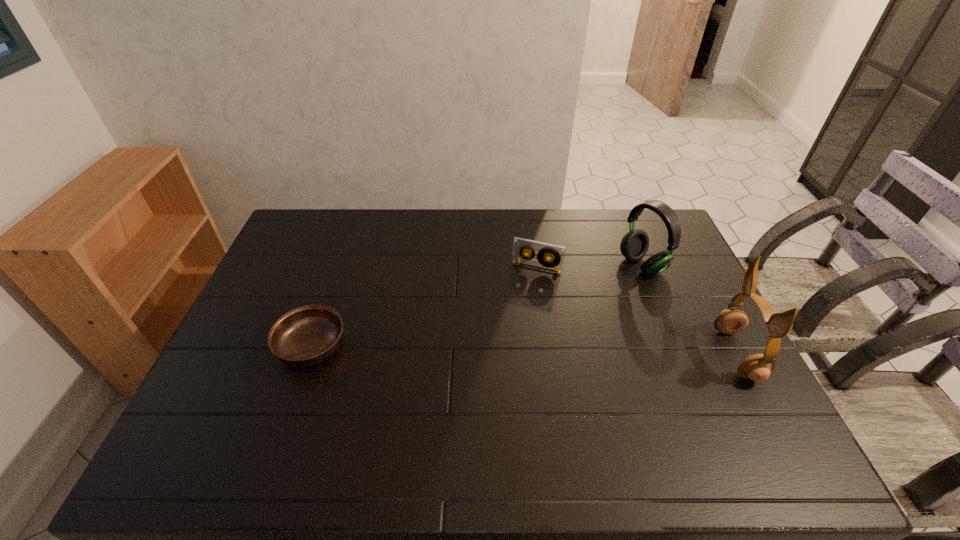
Locate an element on the screen. The width and height of the screenshot is (960, 540). free space located on the front-facing side of the earphone is located at coordinates (603, 354).

At what (x,y) coordinates should I click in order to perform the action: click on free point located 0.340m at the front of the videotape with visible reels. Please return your answer as a coordinate pair (x, y). This screenshot has height=540, width=960. Looking at the image, I should click on (500, 355).

At what (x,y) coordinates should I click in order to perform the action: click on vacant space situated 0.170m at the front of the videotape with visible reels. Please return your answer as a coordinate pair (x, y). The height and width of the screenshot is (540, 960). Looking at the image, I should click on (516, 311).

Locate an element on the screen. blank space located 0.060m at the front of the videotape with visible reels is located at coordinates (525, 287).

The width and height of the screenshot is (960, 540). I want to click on vacant space located 0.210m on the ear cups of the headset, so [x=576, y=298].

Find the location of a particular element. free space located 0.290m on the ear cups of the headset is located at coordinates (556, 307).

The image size is (960, 540). I want to click on vacant space located 0.360m on the ear cups of the headset, so click(537, 316).

This screenshot has width=960, height=540. Identify the location of object at the far edge. (634, 245).

Where is `object that is at the left edge`? The width and height of the screenshot is (960, 540). object that is at the left edge is located at coordinates (308, 335).

Locate an element on the screen. Image resolution: width=960 pixels, height=540 pixels. earphone that is at the right edge is located at coordinates (757, 367).